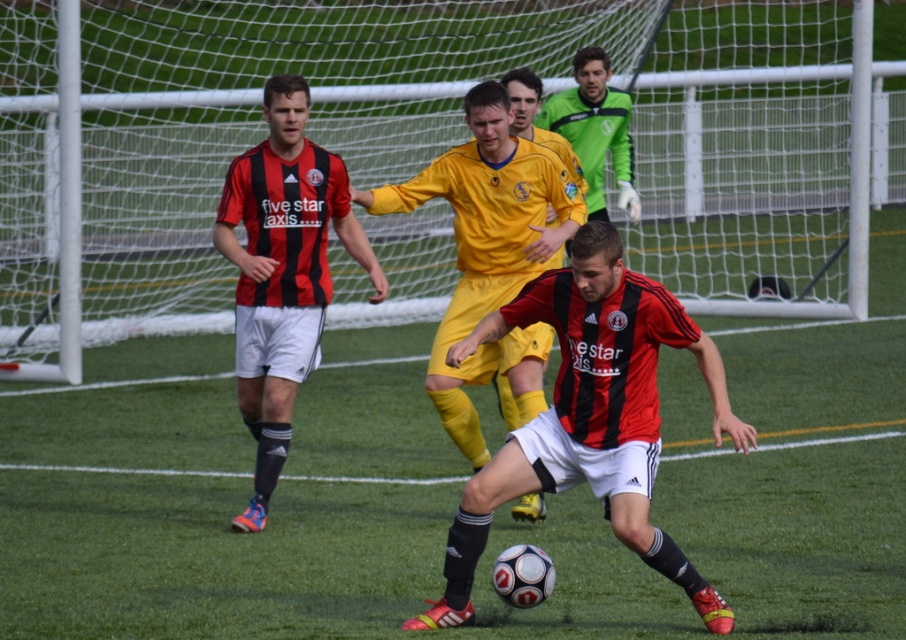
You are a soccer coach analyzing the game. You see the matte black jersey at center and the green matte jersey at upper center. Which player is closer to the camera?

The matte black jersey at center is larger in size than the green matte jersey at upper center, so the matte black jersey at center is closer to the camera.

Consider the image. You are a soccer player positioned at the point marked as point (789, 310) on the field. You want to kick the ball to your teammate who is standing exactly 14 meters away from you. Can you reach your teammate with a single kick?

The distance between you and the camera is 15.01 meters, but the question is about the distance to your teammate, which is 14 meters. Since 14 meters is less than 15.01 meters, you can kick the ball to your teammate within that distance.

You are a soccer coach analyzing the game. You notice two players at center, the matte black soccer player at center and the yellow matte jersey at center. Which player is positioned lower on the field?

The matte black soccer player at center is positioned lower on the field because it is located below the yellow matte jersey at center.